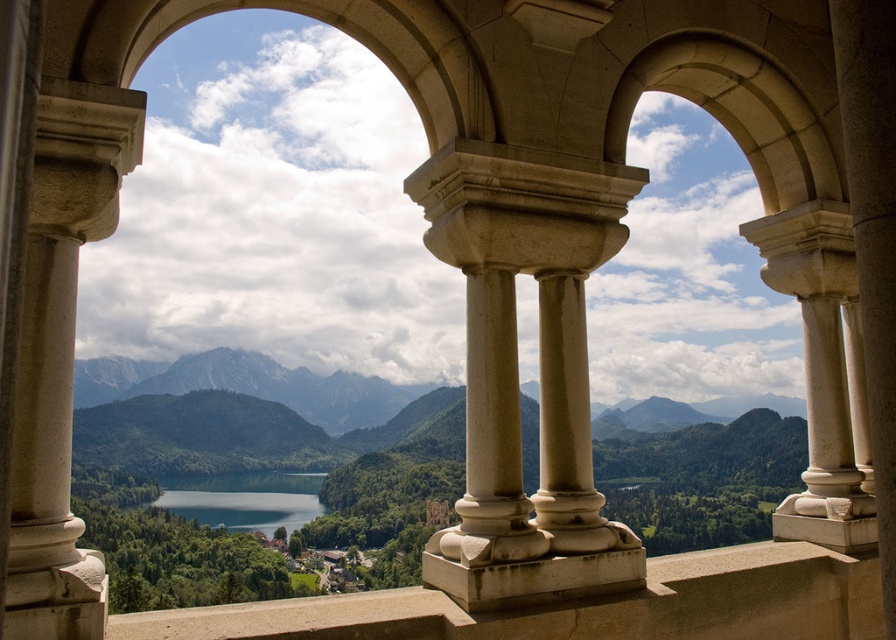
Is point (503, 298) closer to camera compared to point (601, 612)?

That is False.

Can you confirm if beige stone pillars at center is positioned to the right of smooth stone ledge at center?

In fact, beige stone pillars at center is to the left of smooth stone ledge at center.

Is point (420, 193) less distant than point (754, 579)?

No.

Locate an element on the screen. The height and width of the screenshot is (640, 896). beige stone pillars at center is located at coordinates (517, 371).

Between smooth stone column at left and smooth stone ledge at center, which one appears on the right side from the viewer's perspective?

From the viewer's perspective, smooth stone ledge at center appears more on the right side.

Is smooth stone column at left wider than smooth stone ledge at center?

No, smooth stone column at left is not wider than smooth stone ledge at center.

The width and height of the screenshot is (896, 640). I want to click on smooth stone column at left, so click(59, 352).

Can you confirm if smooth stone ledge at center is shorter than shiny blue water at center?

Yes, smooth stone ledge at center is shorter than shiny blue water at center.

The height and width of the screenshot is (640, 896). What do you see at coordinates (579, 605) in the screenshot?
I see `smooth stone ledge at center` at bounding box center [579, 605].

Locate an element on the screen. This screenshot has height=640, width=896. smooth stone ledge at center is located at coordinates (579, 605).